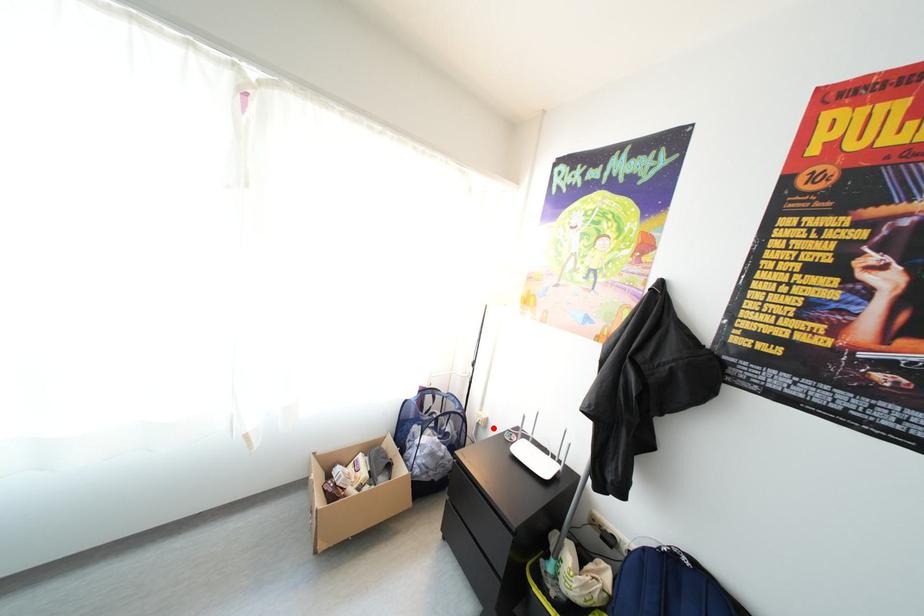
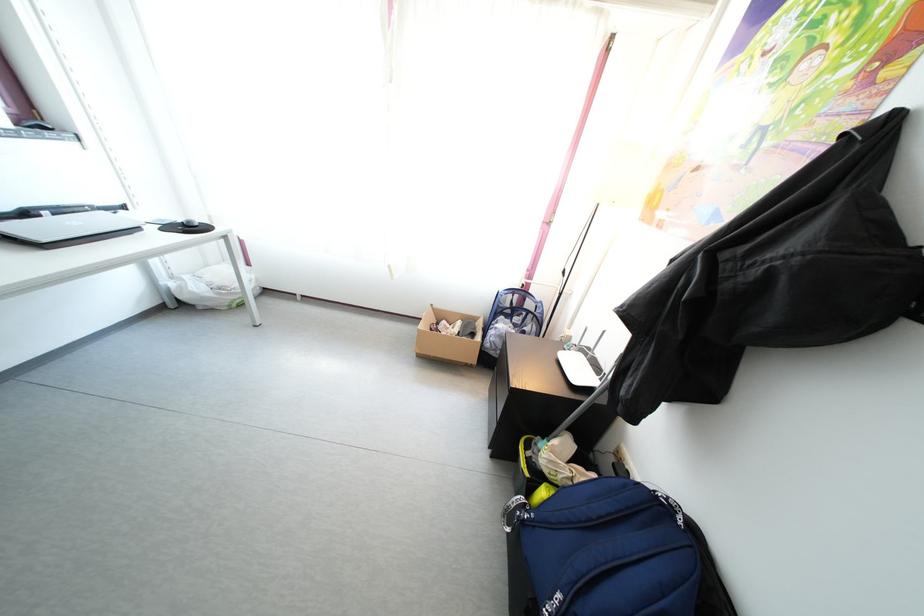
Question: I am providing you with two images of the same scene from different viewpoints. In image1, a red point is highlighted. Considering the same 3D point in image2, which of the following is correct?

Choices:
 (A) It is closer
 (B) It is farther

Answer: (A)